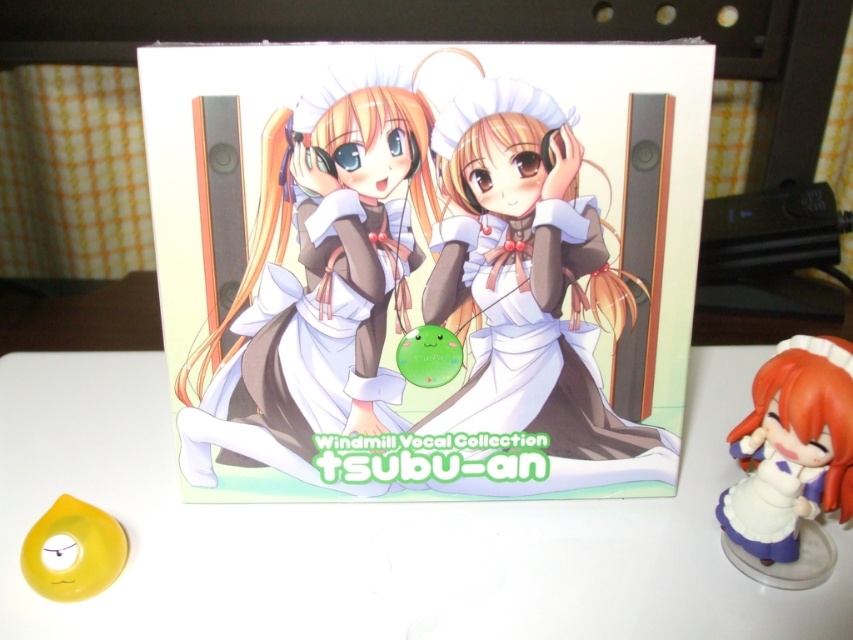
Question: In this image, where is matte brown dress at center located relative to translucent yellow ring at center?

Choices:
 (A) below
 (B) above

Answer: (B)

Question: From the image, what is the correct spatial relationship of white glossy table at center in relation to matte brown dress at center?

Choices:
 (A) left
 (B) right

Answer: (B)

Question: Which object appears closest to the camera in this image?

Choices:
 (A) white glossy table at center
 (B) white glossy figurine at lower right

Answer: (B)

Question: Which object is farther from the camera taking this photo?

Choices:
 (A) white glossy table at center
 (B) matte brown dress at center

Answer: (B)

Question: Does white glossy table at center have a lesser width compared to translucent yellow ring at center?

Choices:
 (A) yes
 (B) no

Answer: (B)

Question: Which point is closer to the camera?

Choices:
 (A) (347, 598)
 (B) (82, 579)
 (C) (265, 275)
 (D) (831, 355)

Answer: (D)